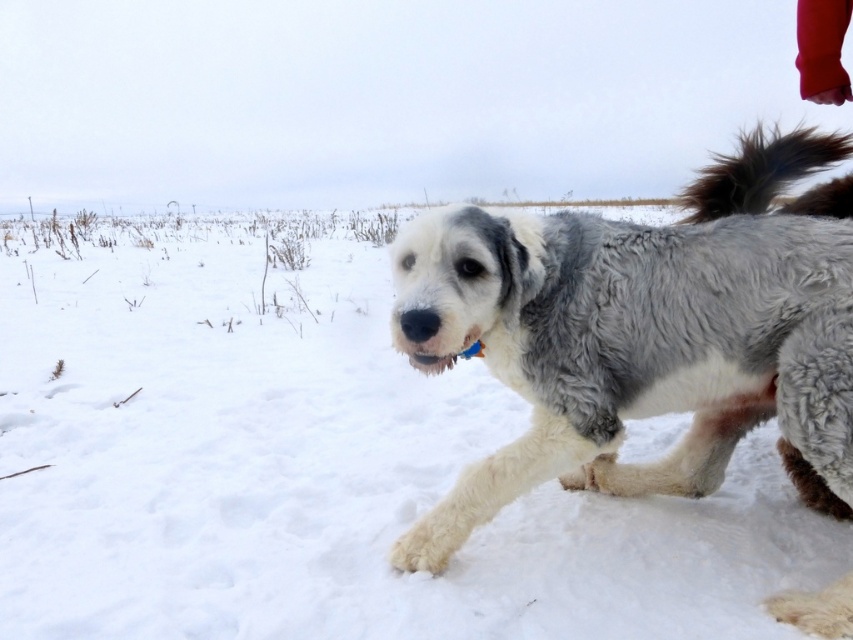
You are standing at the origin point of the image coordinate system. You see a point marked at coordinate (641, 336). What object is located at that point?

The point at coordinate (641, 336) marks the location of the fuzzy gray dog at center.